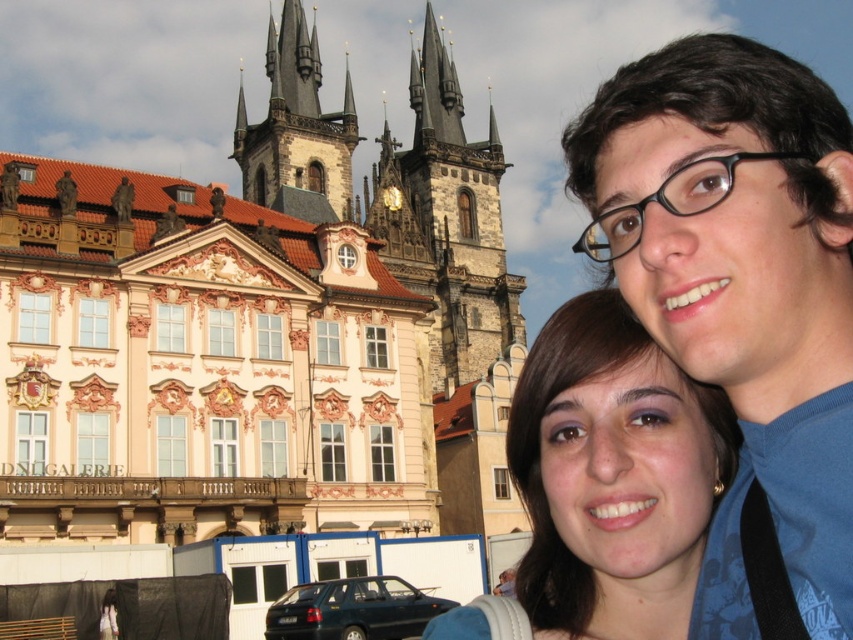
Can you confirm if brown hair at center is smaller than dark brown stone tower at center?

Yes.

Which is below, brown hair at center or dark brown stone tower at center?

Positioned lower is brown hair at center.

Who is more forward, (578, 442) or (312, 163)?

Point (578, 442) is more forward.

Where is `brown hair at center`? brown hair at center is located at coordinates (613, 476).

I want to click on dark gray stone church at upper center, so click(260, 326).

Who is positioned more to the right, dark gray stone church at upper center or brown hair at center?

brown hair at center

Does point (0, 472) lie behind point (572, 621)?

That is True.

You are a GUI agent. You are given a task and a screenshot of the screen. Output one action in this format:
    pyautogui.click(x=<x>, y=<y>)
    Task: Click on the dark gray stone church at upper center
    This screenshot has height=640, width=853.
    Given the screenshot: What is the action you would take?
    pyautogui.click(x=260, y=326)

Which of these two, brown hair at center or dark gray stone tower at center, stands taller?

dark gray stone tower at center

Which is behind, point (563, 604) or point (486, 308)?

The point (486, 308) is behind.

At what (x,y) coordinates should I click in order to perform the action: click on brown hair at center. Please return your answer as a coordinate pair (x, y). The width and height of the screenshot is (853, 640). Looking at the image, I should click on (613, 476).